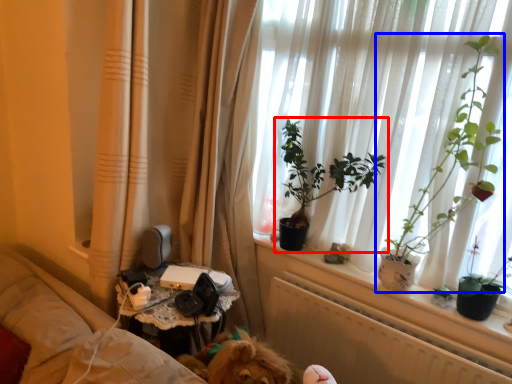
Question: Which of the following is the farthest to the observer, houseplant (highlighted by a red box) or houseplant (highlighted by a blue box)?

Choices:
 (A) houseplant
 (B) houseplant

Answer: (A)